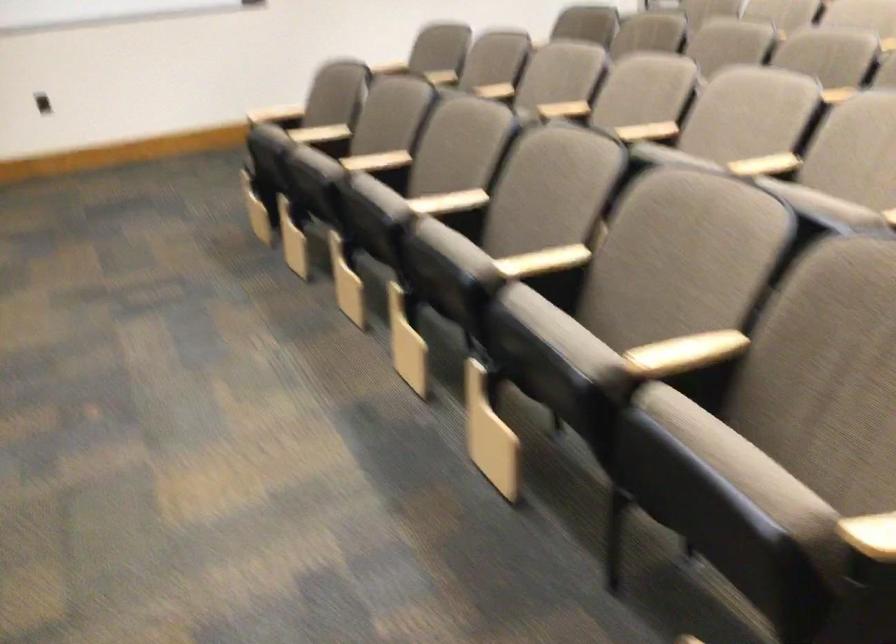
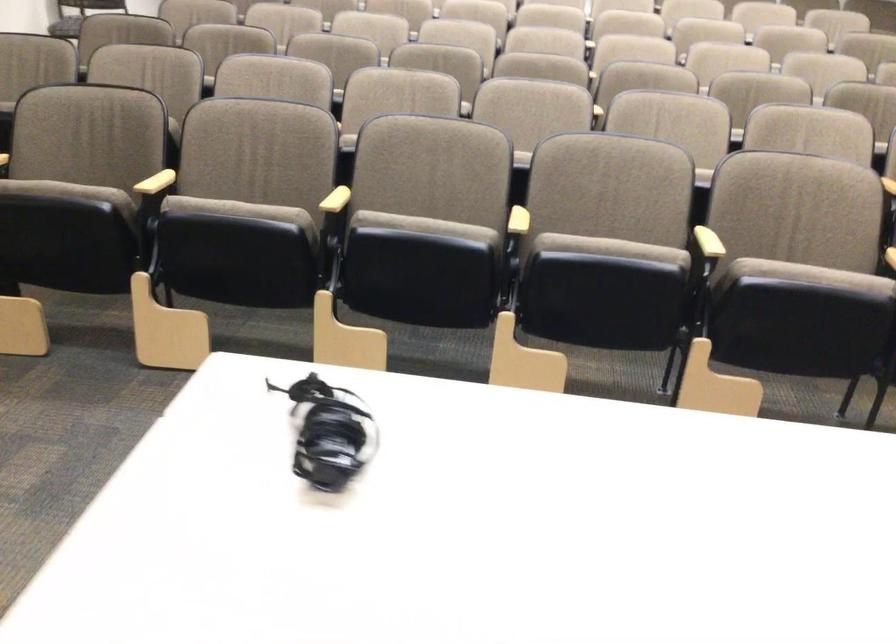
Locate, in the second image, the point that corresponds to pixel 341 160 in the first image.

(336, 200)